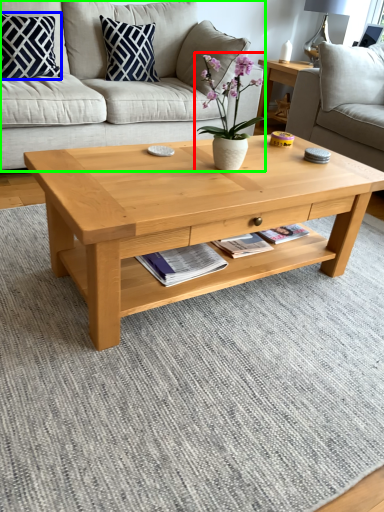
Question: Which object is the farthest from houseplant (highlighted by a red box)? Choose among these: pillow (highlighted by a blue box) or studio couch (highlighted by a green box).

Choices:
 (A) pillow
 (B) studio couch

Answer: (A)